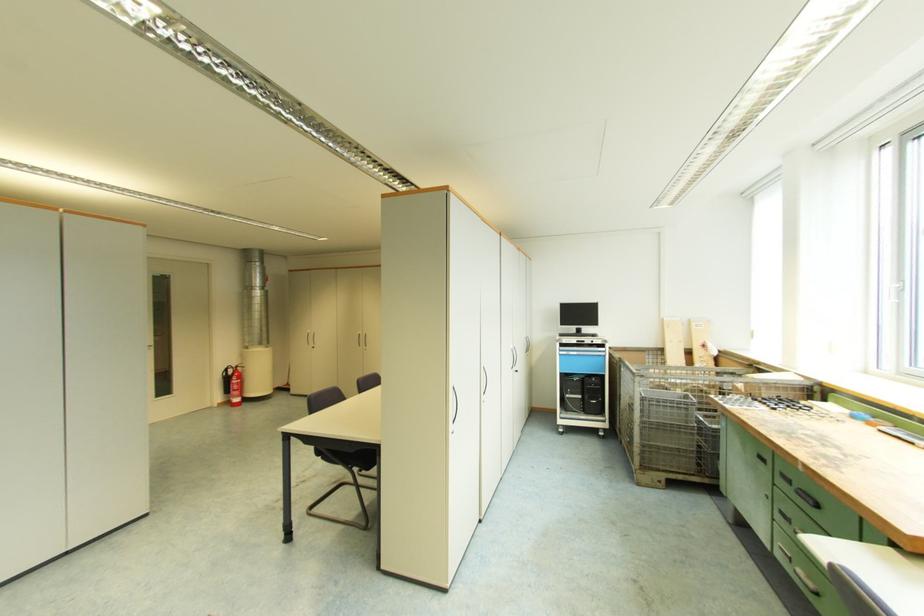
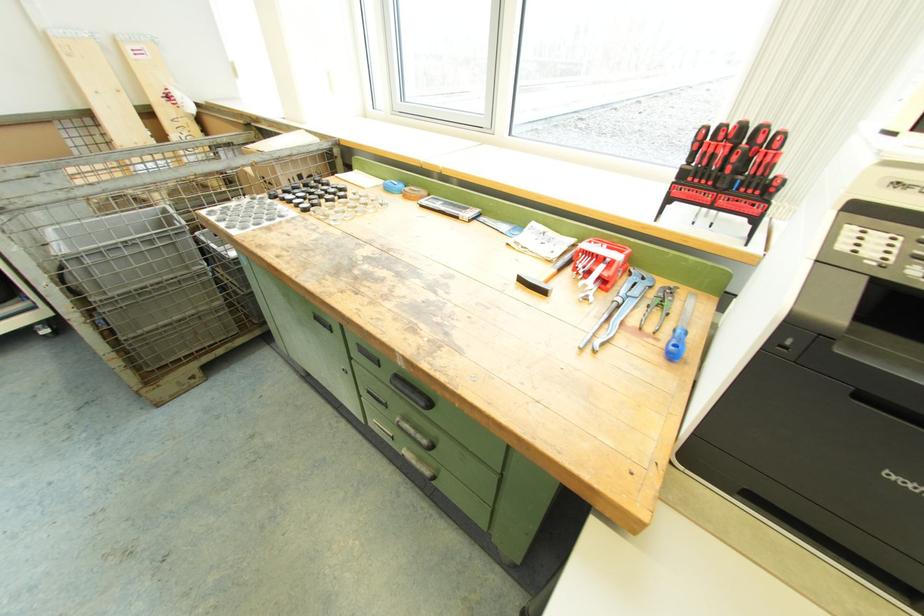
Locate, in the second image, the point that corresponds to the point at 604,430 in the first image.

(43, 326)